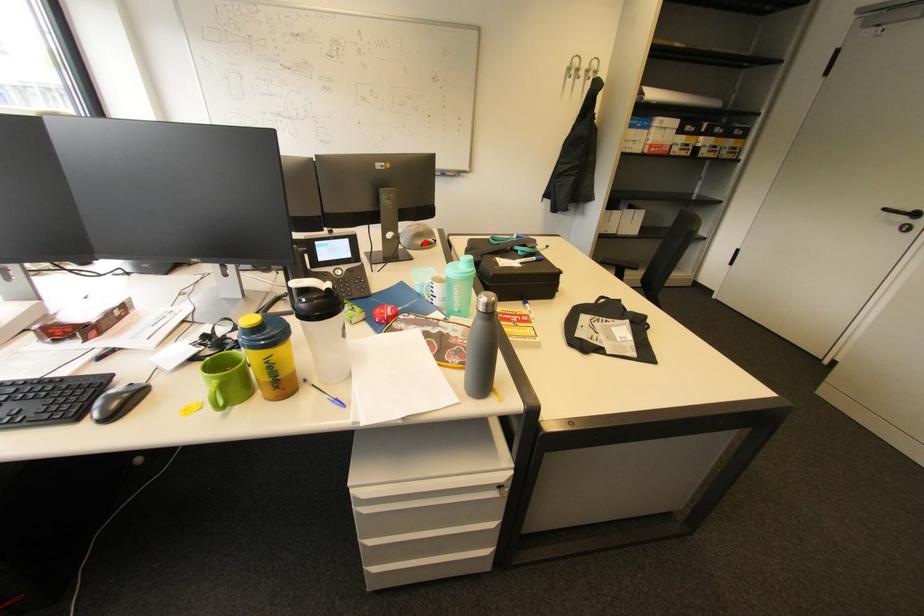
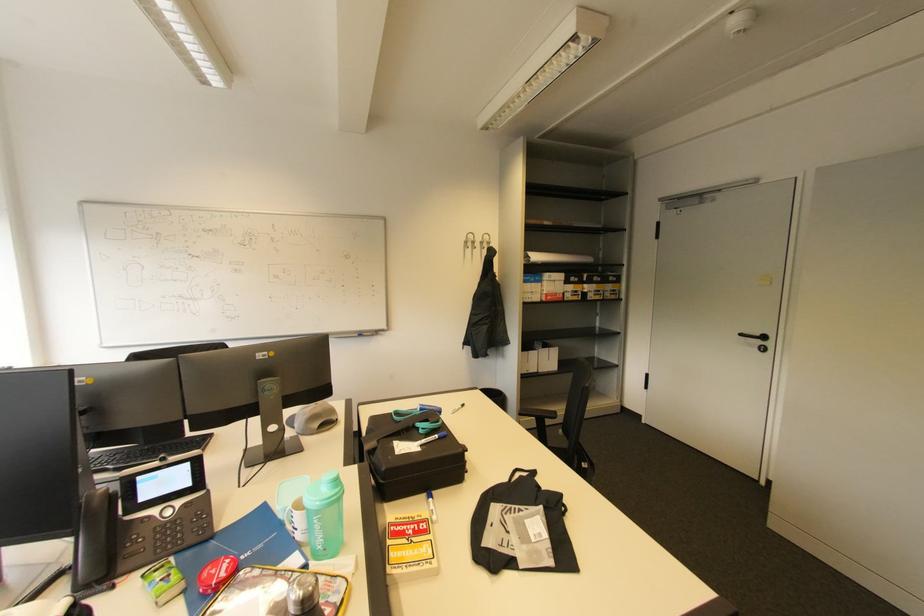
Locate, in the second image, the point that corresponds to the highlighted location in the first image.

(321, 426)